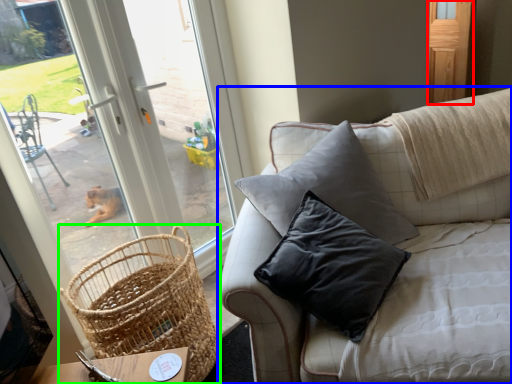
Question: Which is farther away from screen door (highlighted by a red box)? studio couch (highlighted by a blue box) or picnic basket (highlighted by a green box)?

Choices:
 (A) studio couch
 (B) picnic basket

Answer: (B)